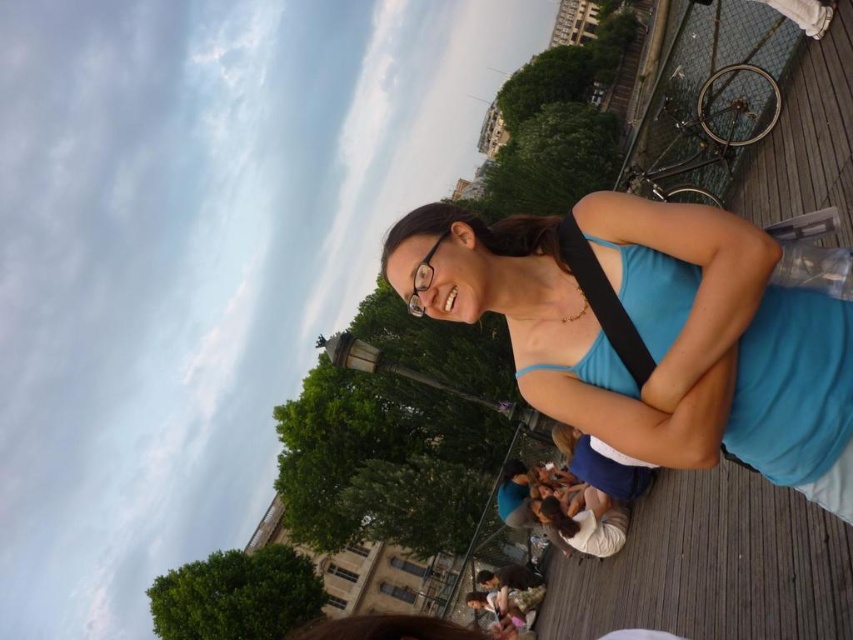
Question: Can you confirm if blue fabric tank top at center is smaller than clear plastic glasses at center?

Choices:
 (A) no
 (B) yes

Answer: (A)

Question: Based on their relative distances, which object is farther from the blue fabric tank top at center?

Choices:
 (A) clear plastic glasses at center
 (B) black fabric strap at upper right

Answer: (A)

Question: Estimate the real-world distances between objects in this image. Which object is farther from the black fabric strap at upper right?

Choices:
 (A) blue fabric tank top at center
 (B) clear plastic glasses at center

Answer: (B)

Question: Which object is the closest to the blue fabric tank top at center?

Choices:
 (A) clear plastic glasses at center
 (B) black fabric strap at upper right

Answer: (B)

Question: Where is blue fabric tank top at center located in relation to black fabric strap at upper right in the image?

Choices:
 (A) left
 (B) right

Answer: (A)

Question: Considering the relative positions of blue fabric tank top at center and clear plastic glasses at center in the image provided, where is blue fabric tank top at center located with respect to clear plastic glasses at center?

Choices:
 (A) right
 (B) left

Answer: (A)